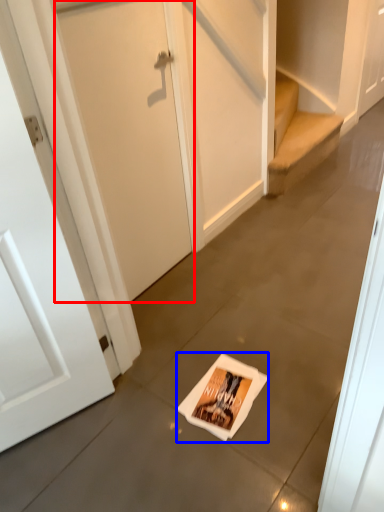
Question: Which object appears closest to the camera in this image, door (highlighted by a red box) or flyer (highlighted by a blue box)?

Choices:
 (A) door
 (B) flyer

Answer: (A)